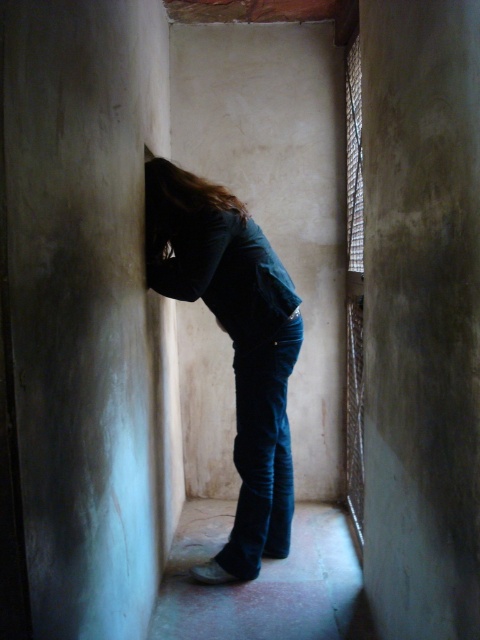
You are navigating through a narrow corridor with aged walls and a window with a metal grill on the right. You see a person wearing dark blue jeans at center leaning against the left wall. If you want to pass by them without entering the area near the window, which direction should you move relative to the corridor?

You should move towards the right side of the corridor away from the left wall since the person is leaning against the left wall, and the window is on the right. This allows you to bypass them while staying clear of the window area.

You are standing at the entrance of the corridor and want to greet the person leaning against the left wall. Which object, the dark blue jeans at center or the brown smooth hair at center, should you look towards first to locate them?

You should look towards the brown smooth hair at center first because it is to the left of the dark blue jeans at center, and the person is leaning against the left wall.